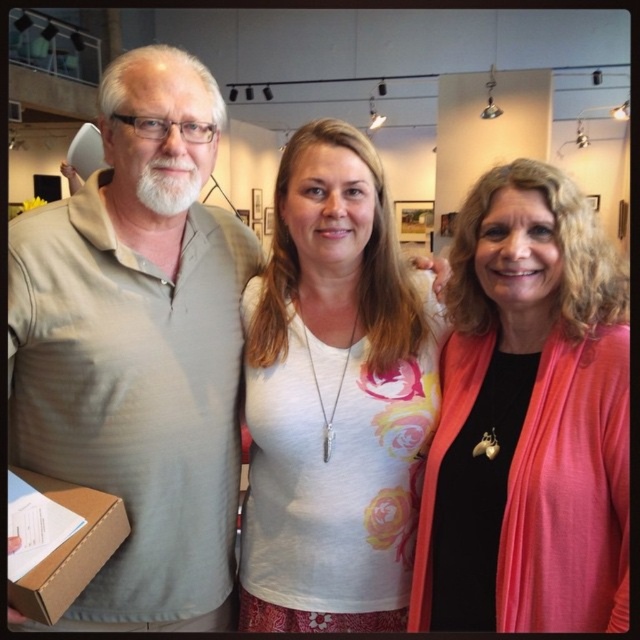
You are standing in an art gallery and see three people. The person on the left is wearing a light beige cotton shirt. The person in the center is wearing a white tshirt with something on it, and the person on the right is wearing a dark blue blazer. Based on their positions, can you determine which direction the light beige cotton shirt at left is facing relative to the other two people?

The light beige cotton shirt at left is located at point (138, 348), so it is facing towards the center of the group. However, without specific spatial relationships between all three individuals provided in the Objects Description, I cannot accurately determine the exact directional relationship between the light beige cotton shirt at left and the other two people beyond their general positions.

You are standing at the entrance of an art gallery and see two people wearing the light beige cotton shirt at left and the white floral shirt at center. Which person is positioned closer to the entrance?

The light beige cotton shirt at left is closer to the viewer than the white floral shirt at center, so the person wearing the light beige cotton shirt at left is closer to the entrance.